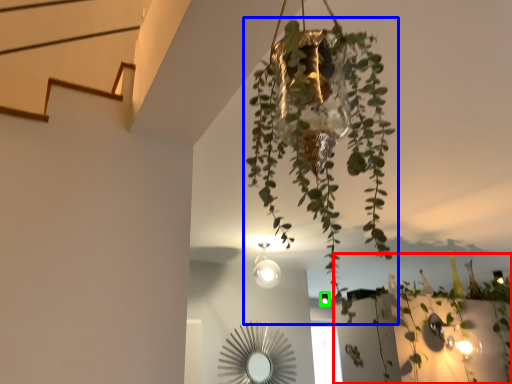
Question: Which object is the farthest from plant (highlighted by a red box)? Choose among these: houseplant (highlighted by a blue box) or light fixture (highlighted by a green box).

Choices:
 (A) houseplant
 (B) light fixture

Answer: (A)